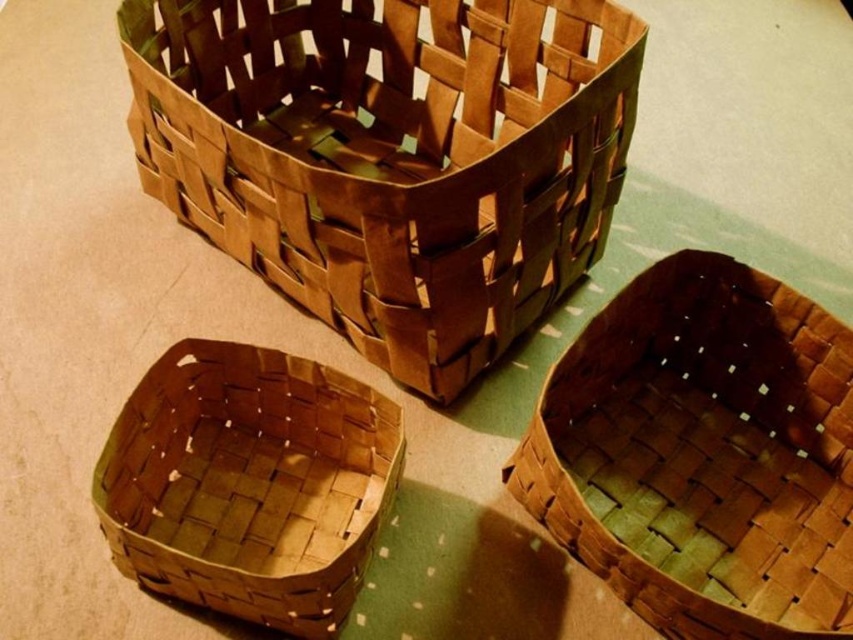
Is brown woven basket at center below brown woven basket at lower left?

No.

Does brown woven basket at center appear on the left side of brown woven basket at lower left?

In fact, brown woven basket at center is to the right of brown woven basket at lower left.

Find the location of a particular element. This screenshot has width=853, height=640. brown woven basket at center is located at coordinates (704, 451).

You are a GUI agent. You are given a task and a screenshot of the screen. Output one action in this format:
    pyautogui.click(x=<x>, y=<y>)
    Task: Click on the brown woven basket at center
    
    Given the screenshot: What is the action you would take?
    pyautogui.click(x=704, y=451)

I want to click on brown woven basket at upper center, so click(x=392, y=157).

Is point (189, 132) in front of point (154, 579)?

No, it is behind (154, 579).

Locate an element on the screen. The height and width of the screenshot is (640, 853). brown woven basket at upper center is located at coordinates (392, 157).

How much distance is there between brown woven basket at upper center and brown woven basket at center?

brown woven basket at upper center is 12.75 inches from brown woven basket at center.

Is point (485, 49) more distant than point (813, 420)?

That is True.

Identify the location of brown woven basket at upper center. (392, 157).